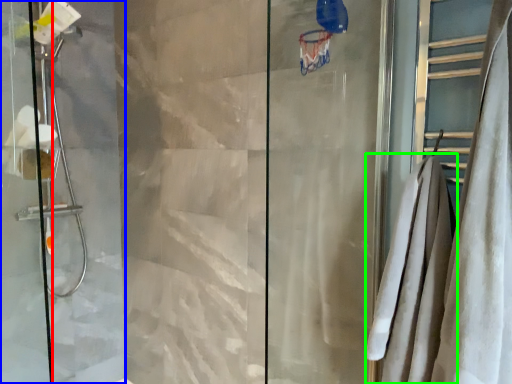
Question: Considering the real-world distances, which object is closest to screen door (highlighted by a red box)? screen door (highlighted by a blue box) or bath towel (highlighted by a green box).

Choices:
 (A) screen door
 (B) bath towel

Answer: (A)